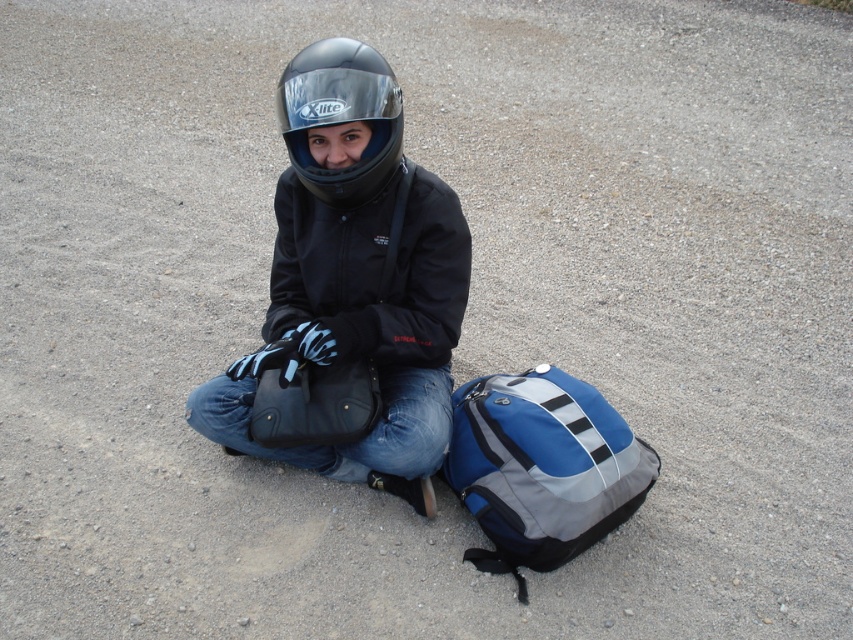
Question: Is the position of blue fabric backpack at lower right more distant than that of matte black helmet at center?

Choices:
 (A) no
 (B) yes

Answer: (B)

Question: Considering the real-world distances, which object is closest to the blue fabric backpack at lower right?

Choices:
 (A) black matte helmet at center
 (B) matte black helmet at center
 (C) matte black bag at center

Answer: (A)

Question: Estimate the real-world distances between objects in this image. Which object is closer to the matte black bag at center?

Choices:
 (A) matte black helmet at center
 (B) black matte helmet at center

Answer: (B)

Question: Where is black matte helmet at center located in relation to blue fabric backpack at lower right in the image?

Choices:
 (A) above
 (B) below

Answer: (A)

Question: Does black matte helmet at center lie behind matte black bag at center?

Choices:
 (A) no
 (B) yes

Answer: (A)

Question: Which is nearer to the blue fabric backpack at lower right?

Choices:
 (A) matte black bag at center
 (B) matte black helmet at center

Answer: (A)